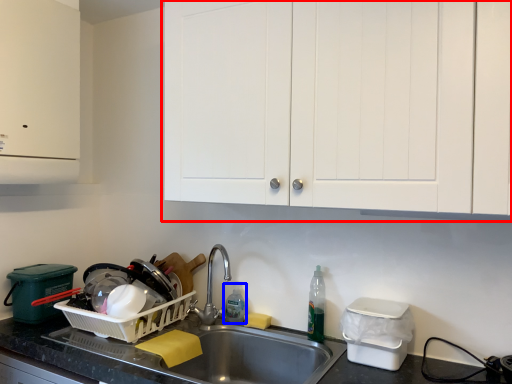
Question: Which point is closer to the camera, cabinetry (highlighted by a red box) or bottle (highlighted by a blue box)?

Choices:
 (A) cabinetry
 (B) bottle

Answer: (A)